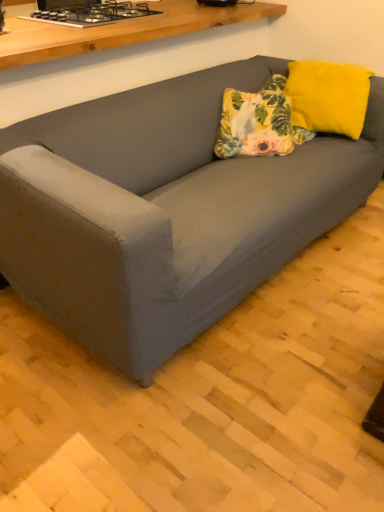
Question: Is black glass stove at upper left touching suede gray couch at center?

Choices:
 (A) no
 (B) yes

Answer: (A)

Question: Could you tell me if black glass stove at upper left is turned towards suede gray couch at center?

Choices:
 (A) yes
 (B) no

Answer: (B)

Question: Is black glass stove at upper left far away from suede gray couch at center?

Choices:
 (A) yes
 (B) no

Answer: (B)

Question: Does black glass stove at upper left have a greater height compared to suede gray couch at center?

Choices:
 (A) yes
 (B) no

Answer: (B)

Question: From the image's perspective, does black glass stove at upper left appear higher than suede gray couch at center?

Choices:
 (A) no
 (B) yes

Answer: (B)

Question: Is black glass stove at upper left at the right side of suede gray couch at center?

Choices:
 (A) no
 (B) yes

Answer: (A)

Question: Can you confirm if floral fabric pillow at center is wider than yellow fuzzy pillow at upper right?

Choices:
 (A) no
 (B) yes

Answer: (B)

Question: Can you confirm if floral fabric pillow at center is smaller than yellow fuzzy pillow at upper right?

Choices:
 (A) no
 (B) yes

Answer: (B)

Question: Is floral fabric pillow at center at the left side of yellow fuzzy pillow at upper right?

Choices:
 (A) yes
 (B) no

Answer: (A)

Question: Is floral fabric pillow at center oriented towards yellow fuzzy pillow at upper right?

Choices:
 (A) yes
 (B) no

Answer: (B)

Question: Is floral fabric pillow at center behind yellow fuzzy pillow at upper right?

Choices:
 (A) yes
 (B) no

Answer: (B)

Question: Is the depth of floral fabric pillow at center less than that of yellow fuzzy pillow at upper right?

Choices:
 (A) yes
 (B) no

Answer: (A)

Question: Would you say suede gray couch at center contains black glass stove at upper left?

Choices:
 (A) no
 (B) yes

Answer: (B)